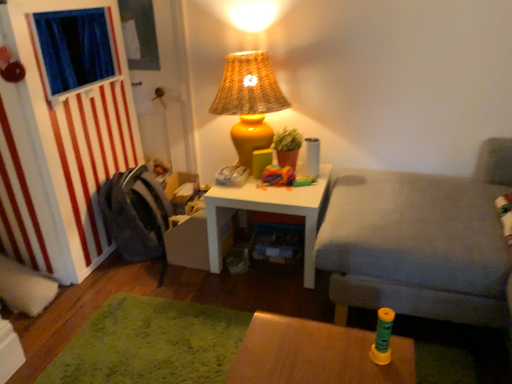
Identify the location of wooden table at lower center, the first table when ordered from front to back. (315, 354).

Where is `gray fabric couch at right`? This screenshot has width=512, height=384. gray fabric couch at right is located at coordinates (420, 242).

Find the location of a particular element. white matte table at center, placed as the 2th table when sorted from front to back is located at coordinates (x=268, y=211).

Measure the distance between point (259, 93) and camera.

A distance of 6.68 feet exists between point (259, 93) and camera.

The image size is (512, 384). Describe the element at coordinates (249, 101) in the screenshot. I see `yellow wicker lampshade at upper center` at that location.

Locate an element on the screen. This screenshot has width=512, height=384. wooden table at lower center, the 2th table in the back-to-front sequence is located at coordinates (315, 354).

Based on the photo, are gray fabric swivel chair at left and white matte table at center, placed as the 2th table when sorted from front to back, making contact?

No.

Is gray fabric swivel chair at left wider than white matte table at center, which ranks as the 1th table in top-to-bottom order?

No, gray fabric swivel chair at left is not wider than white matte table at center, which ranks as the 1th table in top-to-bottom order.

From the image's perspective, is gray fabric swivel chair at left under white matte table at center, which ranks as the second table in bottom-to-top order?

No.

How many degrees apart are the facing directions of gray fabric swivel chair at left and white matte table at center, which ranks as the 1th table in top-to-bottom order?

91.7 degrees.

From the image's perspective, is gray fabric couch at right located above yellow wicker lampshade at upper center?

No.

Are gray fabric couch at right and yellow wicker lampshade at upper center located far from each other?

No, gray fabric couch at right is not far away from yellow wicker lampshade at upper center.

How distant is gray fabric couch at right from yellow wicker lampshade at upper center?

gray fabric couch at right is 29.80 inches from yellow wicker lampshade at upper center.

Find the location of a particular element. This screenshot has height=384, width=512. couch that appears on the right of yellow wicker lampshade at upper center is located at coordinates (420, 242).

Does yellow wicker lampshade at upper center touch wooden table at lower center, the first table when ordered from front to back?

They are not placed beside each other.

The image size is (512, 384). I want to click on lamp above the wooden table at lower center, the 2th table in the back-to-front sequence (from the image's perspective), so (249, 101).

From a real-world perspective, is yellow wicker lampshade at upper center on wooden table at lower center, the first table when ordered from front to back?

Correct, in the physical world, yellow wicker lampshade at upper center is higher than wooden table at lower center, the first table when ordered from front to back.

Measure the distance from yellow wicker lampshade at upper center to wooden table at lower center, the 2th table when ordered from top to bottom.

yellow wicker lampshade at upper center and wooden table at lower center, the 2th table when ordered from top to bottom, are 1.14 meters apart.

Find the location of a particular element. This screenshot has height=384, width=512. lamp that is on the left side of white matte table at center, which ranks as the second table in bottom-to-top order is located at coordinates [249, 101].

Is yellow wicker lampshade at upper center closer to camera compared to white matte table at center, which ranks as the 1th table in top-to-bottom order?

Yes, yellow wicker lampshade at upper center is closer to the camera.

Choose the correct answer: Is yellow wicker lampshade at upper center inside white matte table at center, placed as the 2th table when sorted from front to back, or outside it?

yellow wicker lampshade at upper center exists outside the volume of white matte table at center, placed as the 2th table when sorted from front to back.

From a real-world perspective, is blue fabric curtain at left located higher than yellow wicker lampshade at upper center?

No, from a real-world perspective, blue fabric curtain at left is not over yellow wicker lampshade at upper center

Between blue fabric curtain at left and yellow wicker lampshade at upper center, which one has larger width?

Wider between the two is blue fabric curtain at left.

Find the location of a particular element. The width and height of the screenshot is (512, 384). lamp above the blue fabric curtain at left (from a real-world perspective) is located at coordinates (249, 101).

Is blue fabric curtain at left not close to yellow wicker lampshade at upper center?

No, there isn't a large distance between blue fabric curtain at left and yellow wicker lampshade at upper center.

From a real-world perspective, is gray fabric couch at right located higher than wooden table at lower center, the first table when ordered from front to back?

Indeed, from a real-world perspective, gray fabric couch at right stands above wooden table at lower center, the first table when ordered from front to back.

Looking at the image, does gray fabric couch at right seem bigger or smaller compared to wooden table at lower center, the 2th table in the back-to-front sequence?

Clearly, gray fabric couch at right is larger in size than wooden table at lower center, the 2th table in the back-to-front sequence.

Is gray fabric couch at right inside or outside of wooden table at lower center, the 2th table in the back-to-front sequence?

gray fabric couch at right is outside wooden table at lower center, the 2th table in the back-to-front sequence.

Could you measure the distance between gray fabric couch at right and wooden table at lower center, the 2th table when ordered from top to bottom?

They are 24.55 inches apart.

Considering the relative sizes of wooden table at lower center, the first table when ordered from front to back, and white matte table at center, which ranks as the 1th table in top-to-bottom order, in the image provided, is wooden table at lower center, the first table when ordered from front to back, smaller than white matte table at center, which ranks as the 1th table in top-to-bottom order,?

Indeed, wooden table at lower center, the first table when ordered from front to back, has a smaller size compared to white matte table at center, which ranks as the 1th table in top-to-bottom order.

From the image's perspective, which is above, wooden table at lower center, marked as the first table in a bottom-to-top arrangement, or white matte table at center, which ranks as the second table in bottom-to-top order?

white matte table at center, which ranks as the second table in bottom-to-top order.

Is wooden table at lower center, the first table when ordered from front to back, in contact with white matte table at center, which ranks as the second table in bottom-to-top order?

wooden table at lower center, the first table when ordered from front to back, and white matte table at center, which ranks as the second table in bottom-to-top order, are clearly separated.

At what (x,y) coordinates should I click in order to perform the action: click on table behind the wooden table at lower center, marked as the first table in a bottom-to-top arrangement. Please return your answer as a coordinate pair (x, y). The height and width of the screenshot is (384, 512). Looking at the image, I should click on (268, 211).

Where is `swivel chair located on the left of white matte table at center, which is the 1th table in back-to-front order`? This screenshot has height=384, width=512. swivel chair located on the left of white matte table at center, which is the 1th table in back-to-front order is located at coordinates coord(136,216).

Locate an element on the screen. The height and width of the screenshot is (384, 512). lamp above the gray fabric couch at right (from the image's perspective) is located at coordinates (249, 101).

Considering their positions, is gray fabric couch at right positioned closer to wooden table at lower center, the 2th table when ordered from top to bottom, than gray fabric swivel chair at left?

The object closer to wooden table at lower center, the 2th table when ordered from top to bottom, is gray fabric couch at right.

Which object lies nearer to the anchor point blue fabric curtain at left, gray fabric couch at right or white matte table at center, placed as the 2th table when sorted from front to back?

white matte table at center, placed as the 2th table when sorted from front to back, lies closer to blue fabric curtain at left than the other object.

Estimate the real-world distances between objects in this image. Which object is closer to white matte table at center, which ranks as the second table in bottom-to-top order, yellow wicker lampshade at upper center or wooden table at lower center, the first table when ordered from front to back?

yellow wicker lampshade at upper center.

Based on their spatial positions, is wooden table at lower center, the 2th table when ordered from top to bottom, or gray fabric couch at right closer to yellow wicker lampshade at upper center?

gray fabric couch at right.

Based on their spatial positions, is gray fabric couch at right or white matte table at center, which ranks as the 1th table in top-to-bottom order, further from gray fabric swivel chair at left?

Among the two, gray fabric couch at right is located further to gray fabric swivel chair at left.

Based on their spatial positions, is wooden table at lower center, the first table when ordered from front to back, or gray fabric couch at right further from white matte table at center, which ranks as the second table in bottom-to-top order?

wooden table at lower center, the first table when ordered from front to back, lies further to white matte table at center, which ranks as the second table in bottom-to-top order, than the other object.

Which object lies further to the anchor point wooden table at lower center, the 2th table when ordered from top to bottom, yellow wicker lampshade at upper center or white matte table at center, which ranks as the 1th table in top-to-bottom order?

The object further to wooden table at lower center, the 2th table when ordered from top to bottom, is yellow wicker lampshade at upper center.

Which object lies nearer to the anchor point gray fabric couch at right, wooden table at lower center, marked as the first table in a bottom-to-top arrangement, or white matte table at center, which is the 1th table in back-to-front order?

Among the two, white matte table at center, which is the 1th table in back-to-front order, is located nearer to gray fabric couch at right.

The width and height of the screenshot is (512, 384). I want to click on lamp between gray fabric swivel chair at left and white matte table at center, which ranks as the 1th table in top-to-bottom order, in the horizontal direction, so click(x=249, y=101).

Identify the location of swivel chair between blue fabric curtain at left and gray fabric couch at right in the horizontal direction. pos(136,216).

Locate an element on the screen. couch between yellow wicker lampshade at upper center and wooden table at lower center, the 2th table when ordered from top to bottom, in the up-down direction is located at coordinates (420, 242).

This screenshot has width=512, height=384. In order to click on lamp located between blue fabric curtain at left and white matte table at center, placed as the 2th table when sorted from front to back, in the left-right direction in this screenshot , I will do `click(249, 101)`.